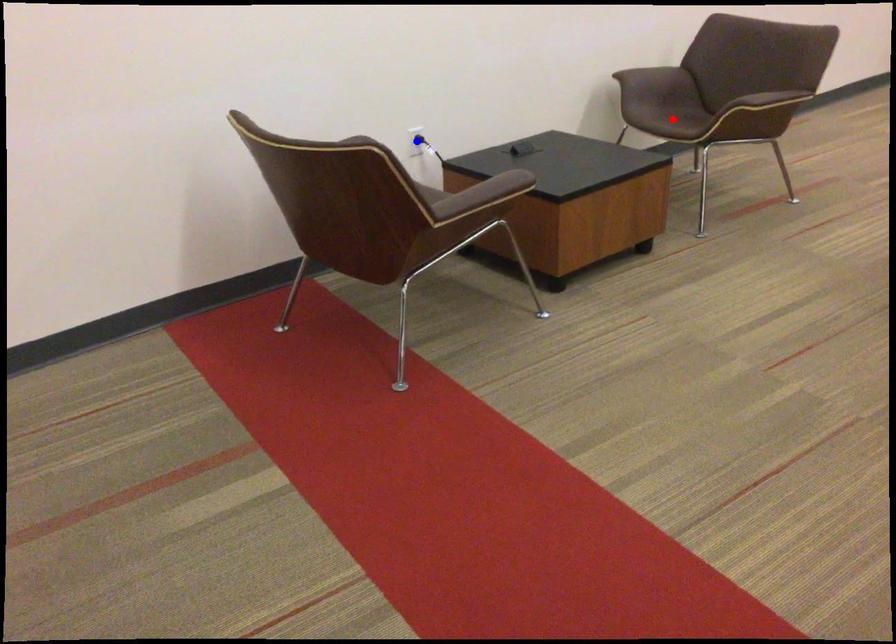
Question: Which of the two points in the image is closer to the camera?

Choices:
 (A) Blue point is closer.
 (B) Red point is closer.

Answer: (A)